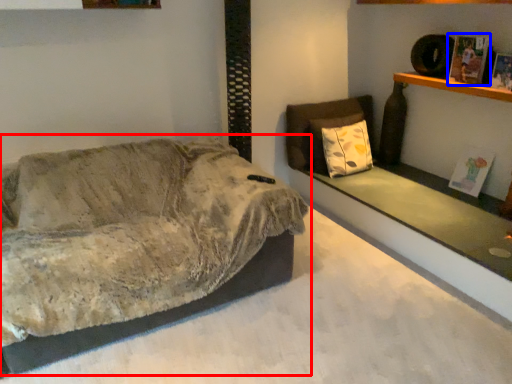
Question: Which of the following is the closest to the observer, studio couch (highlighted by a red box) or magazine (highlighted by a blue box)?

Choices:
 (A) studio couch
 (B) magazine

Answer: (A)